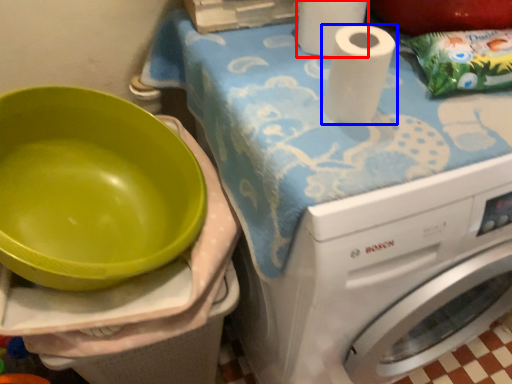
Question: Among these objects, which one is farthest to the camera, paper towel (highlighted by a red box) or paper towel (highlighted by a blue box)?

Choices:
 (A) paper towel
 (B) paper towel

Answer: (A)